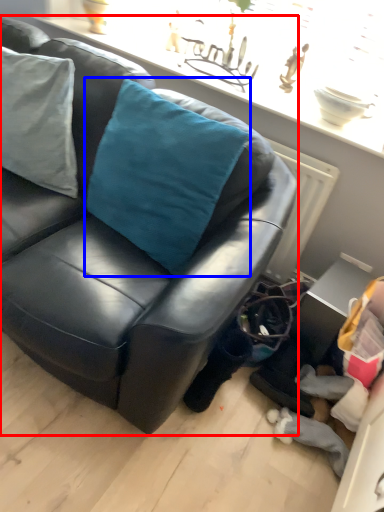
Question: Which object appears farthest to the camera in this image, studio couch (highlighted by a red box) or throw pillow (highlighted by a blue box)?

Choices:
 (A) studio couch
 (B) throw pillow

Answer: (B)